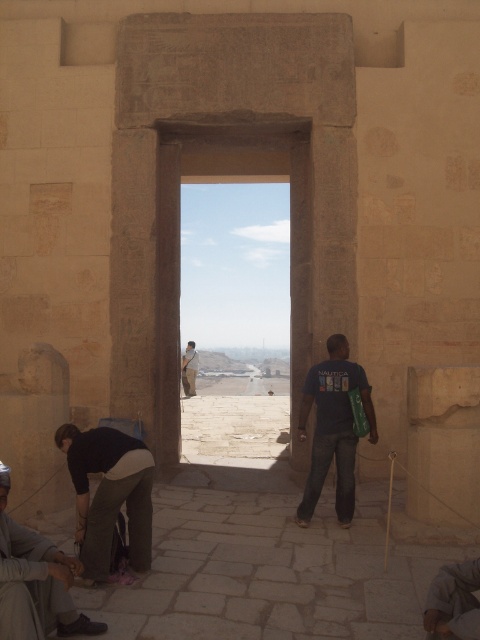
You are standing in front of an ancient Egyptian temple. You see a beige stone archway at center and a dark gray fabric shoe at lower left. Which object is positioned to the right side of the other?

The beige stone archway at center is to the right of the dark gray fabric shoe at lower left.

You are standing in front of the ancient stone doorway and want to walk through it to explore the desert landscape beyond. Based on the doorway dimensions, will you be able to pass through the beige stone archway at center?

The beige stone archway at center is located at point (179, 236), which indicates its position but does not provide specific dimensions. Without knowing the height or width of the archway, it is impossible to determine if you can pass through it. More information about the archway dimensions is needed.